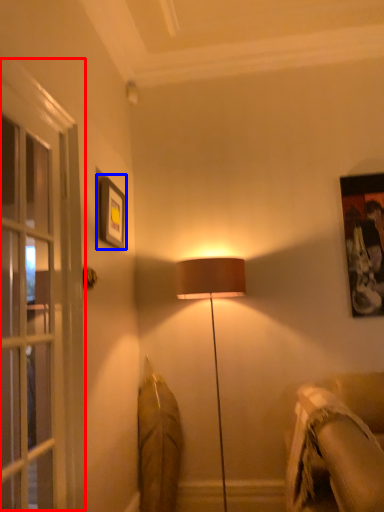
Question: Which point is further to the camera, screen door (highlighted by a red box) or picture frame (highlighted by a blue box)?

Choices:
 (A) screen door
 (B) picture frame

Answer: (B)